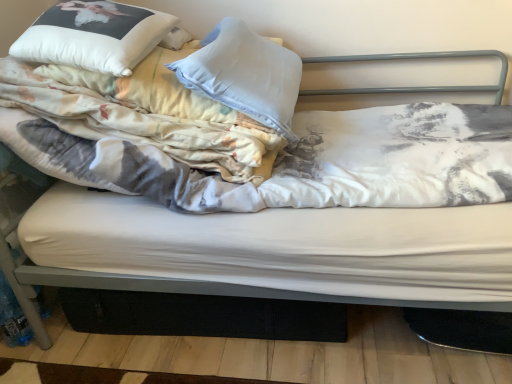
Question: Is white soft pillow at upper left, acting as the 2th pillow starting from the left, taller than printed cotton blanket at left?

Choices:
 (A) yes
 (B) no

Answer: (B)

Question: Is white soft pillow at upper left, acting as the 2th pillow starting from the left, closer to the viewer compared to printed cotton blanket at left?

Choices:
 (A) no
 (B) yes

Answer: (A)

Question: Considering the relative sizes of white soft pillow at upper left, marked as the 1th pillow in a right-to-left arrangement, and printed cotton blanket at left in the image provided, is white soft pillow at upper left, marked as the 1th pillow in a right-to-left arrangement, smaller than printed cotton blanket at left?

Choices:
 (A) yes
 (B) no

Answer: (A)

Question: Can you confirm if white soft pillow at upper left, marked as the 1th pillow in a right-to-left arrangement, is positioned to the left of printed cotton blanket at left?

Choices:
 (A) yes
 (B) no

Answer: (B)

Question: Is white soft pillow at upper left, marked as the 1th pillow in a right-to-left arrangement, facing away from printed cotton blanket at left?

Choices:
 (A) yes
 (B) no

Answer: (A)

Question: Is white soft pillow at upper left, acting as the 2th pillow starting from the left, wider or thinner than printed cotton blanket at left?

Choices:
 (A) wide
 (B) thin

Answer: (B)

Question: In terms of size, does white soft pillow at upper left, marked as the 1th pillow in a right-to-left arrangement, appear bigger or smaller than printed cotton blanket at left?

Choices:
 (A) small
 (B) big

Answer: (A)

Question: Is white soft pillow at upper left, acting as the 2th pillow starting from the left, taller or shorter than printed cotton blanket at left?

Choices:
 (A) short
 (B) tall

Answer: (A)

Question: Does point (274, 114) appear closer or farther from the camera than point (64, 152)?

Choices:
 (A) closer
 (B) farther

Answer: (B)

Question: In terms of height, does white soft pillow at upper left, which is the 2th pillow from right to left, look taller or shorter compared to white soft pillow at upper left, marked as the 1th pillow in a right-to-left arrangement?

Choices:
 (A) tall
 (B) short

Answer: (B)

Question: Considering the relative positions of white soft pillow at upper left, which is the 1th pillow from left to right, and white soft pillow at upper left, acting as the 2th pillow starting from the left, in the image provided, is white soft pillow at upper left, which is the 1th pillow from left to right, to the left or to the right of white soft pillow at upper left, acting as the 2th pillow starting from the left,?

Choices:
 (A) left
 (B) right

Answer: (A)

Question: In the image, is white soft pillow at upper left, which is the 1th pillow from left to right, positioned in front of or behind white soft pillow at upper left, acting as the 2th pillow starting from the left?

Choices:
 (A) front
 (B) behind

Answer: (A)

Question: Considering the positions of point (103, 29) and point (246, 112), is point (103, 29) closer or farther from the camera than point (246, 112)?

Choices:
 (A) farther
 (B) closer

Answer: (B)

Question: Considering the positions of white soft pillow at upper left, which is the 1th pillow from left to right, and printed cotton blanket at left in the image, is white soft pillow at upper left, which is the 1th pillow from left to right, wider or thinner than printed cotton blanket at left?

Choices:
 (A) wide
 (B) thin

Answer: (B)

Question: From a real-world perspective, is white soft pillow at upper left, which is the 2th pillow from right to left, above or below printed cotton blanket at left?

Choices:
 (A) above
 (B) below

Answer: (A)